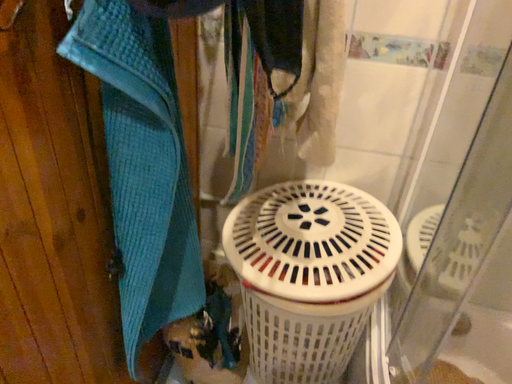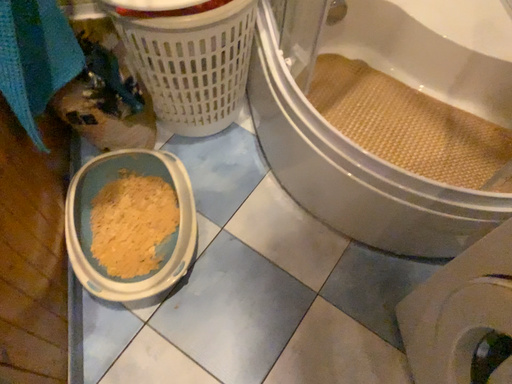
Question: Which way did the camera rotate in the video?

Choices:
 (A) rotated downward
 (B) rotated upward

Answer: (A)